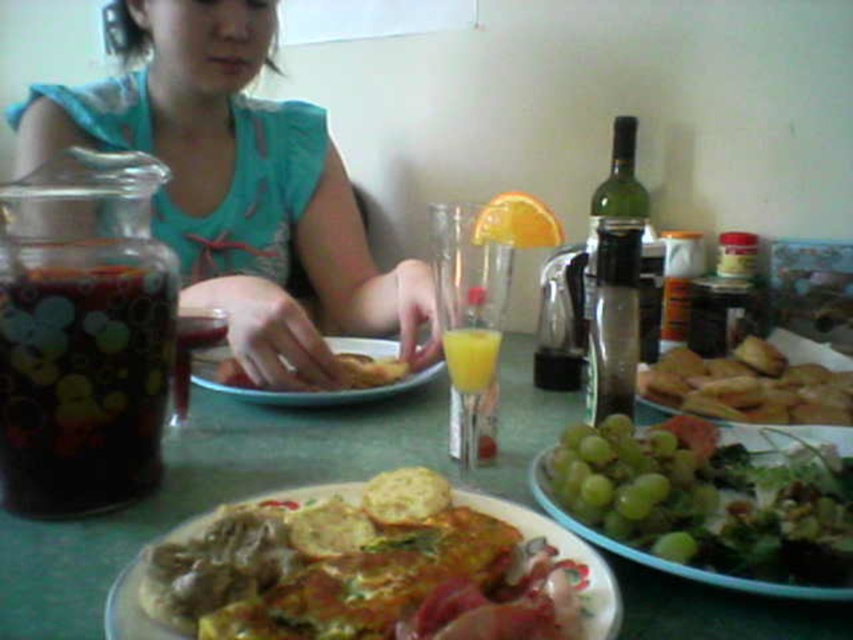
Question: Is dark glossy jar at left to the right of orange matte at upper center from the viewer's perspective?

Choices:
 (A) no
 (B) yes

Answer: (A)

Question: Does dark glossy jar at left come behind matte yellow bread at center?

Choices:
 (A) no
 (B) yes

Answer: (A)

Question: Is yellow translucent glass at center above matte yellow bread at center?

Choices:
 (A) yes
 (B) no

Answer: (A)

Question: Which point appears farthest from the camera in this image?

Choices:
 (A) (733, 356)
 (B) (486, 552)
 (C) (51, 497)

Answer: (A)

Question: Which object appears closest to the camera in this image?

Choices:
 (A) green leafy salad at lower right
 (B) matte yellow bread at center
 (C) matte glass juice at center
 (D) dark red glass at center

Answer: (C)

Question: Which is farther from the orange matte at upper center?

Choices:
 (A) blue fabric shirt at upper left
 (B) golden brown croutons at right
 (C) dark red glass at center

Answer: (A)